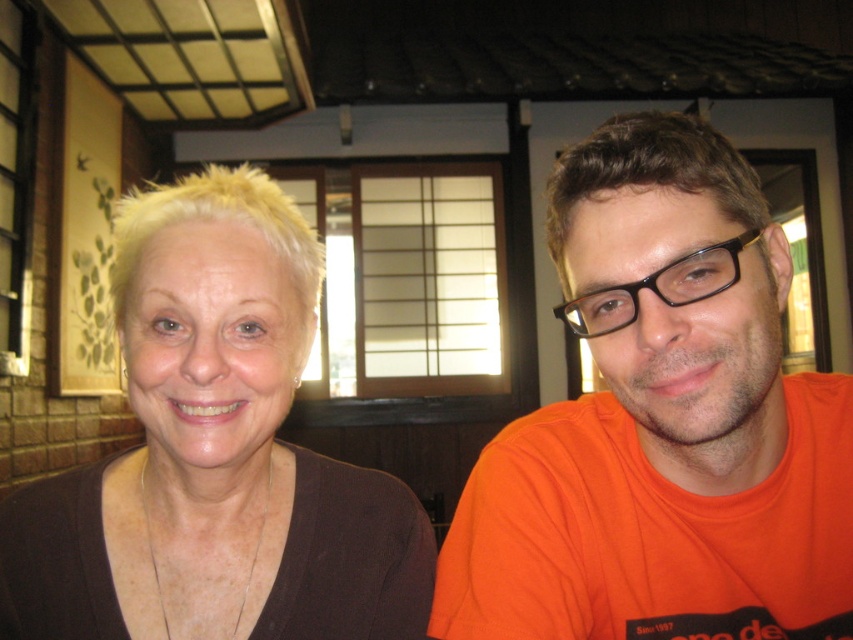
Is point (556, 529) less distant than point (299, 312)?

No, it is behind (299, 312).

Between point (537, 528) and point (231, 525), which one is positioned behind?

Point (537, 528)

Is point (689, 464) positioned after point (100, 493)?

No, it is not.

The image size is (853, 640). In order to click on orange cotton t-shirt at right in this screenshot , I will do `click(662, 424)`.